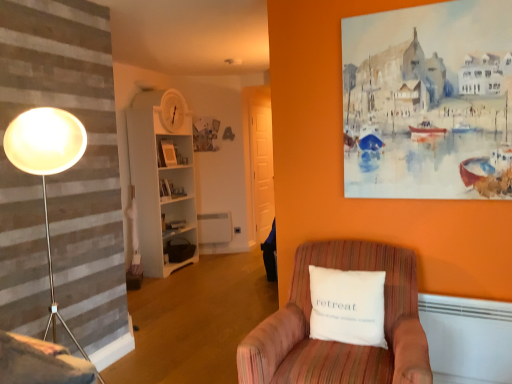
Question: Should I look upward or downward to see white wood bookshelf at center?

Choices:
 (A) down
 (B) up

Answer: (B)

Question: From a real-world perspective, is striped fabric armchair at lower right beneath white wood bookshelf at center?

Choices:
 (A) no
 (B) yes

Answer: (B)

Question: Considering the relative positions of striped fabric armchair at lower right and white wood bookshelf at center in the image provided, is striped fabric armchair at lower right to the left of white wood bookshelf at center from the viewer's perspective?

Choices:
 (A) no
 (B) yes

Answer: (A)

Question: Is striped fabric armchair at lower right behind white wood bookshelf at center?

Choices:
 (A) yes
 (B) no

Answer: (B)

Question: Is striped fabric armchair at lower right thinner than white wood bookshelf at center?

Choices:
 (A) yes
 (B) no

Answer: (B)

Question: Is striped fabric armchair at lower right outside of white wood bookshelf at center?

Choices:
 (A) yes
 (B) no

Answer: (A)

Question: Can you confirm if striped fabric armchair at lower right is bigger than white wood bookshelf at center?

Choices:
 (A) no
 (B) yes

Answer: (A)

Question: Is white wood bookshelf at center completely or partially outside of striped fabric armchair at lower right?

Choices:
 (A) no
 (B) yes

Answer: (B)

Question: Is white wood bookshelf at center positioned far away from striped fabric armchair at lower right?

Choices:
 (A) no
 (B) yes

Answer: (B)

Question: Does white wood bookshelf at center come behind striped fabric armchair at lower right?

Choices:
 (A) yes
 (B) no

Answer: (A)

Question: Is white wood bookshelf at center surrounding striped fabric armchair at lower right?

Choices:
 (A) yes
 (B) no

Answer: (B)

Question: Considering the relative positions of white wood bookshelf at center and striped fabric armchair at lower right in the image provided, is white wood bookshelf at center in front of striped fabric armchair at lower right?

Choices:
 (A) yes
 (B) no

Answer: (B)

Question: Considering the relative sizes of white wood bookshelf at center and striped fabric armchair at lower right in the image provided, is white wood bookshelf at center thinner than striped fabric armchair at lower right?

Choices:
 (A) yes
 (B) no

Answer: (A)

Question: Considering the relative positions of striped fabric armchair at lower right and velvet pink swivel chair at lower left in the image provided, is striped fabric armchair at lower right in front of velvet pink swivel chair at lower left?

Choices:
 (A) no
 (B) yes

Answer: (B)